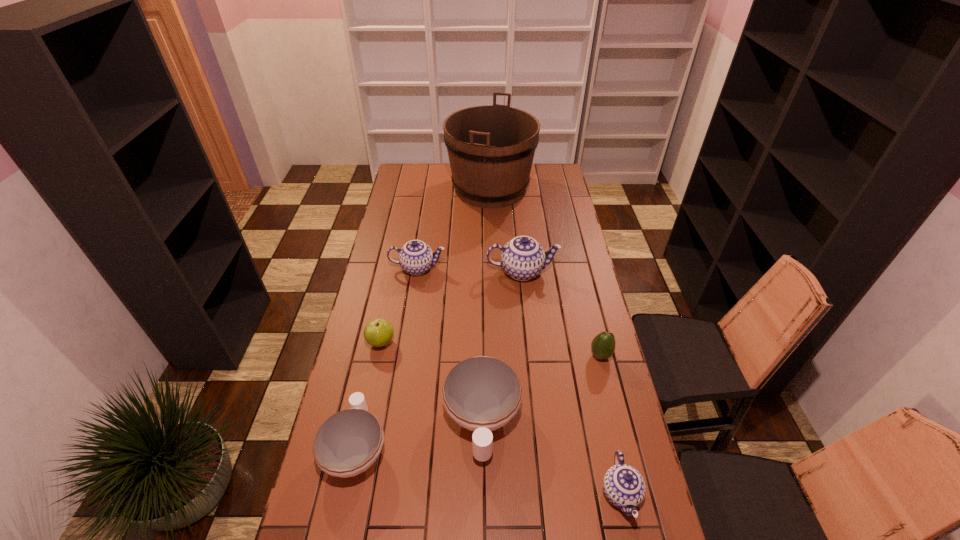
This screenshot has height=540, width=960. I want to click on object at the far edge, so (x=491, y=148).

At what (x,y) coordinates should I click in order to perform the action: click on apple at the left edge. Please return your answer as a coordinate pair (x, y). The width and height of the screenshot is (960, 540). Looking at the image, I should click on (379, 332).

At what (x,y) coordinates should I click in order to perform the action: click on avocado that is positioned at the right edge. Please return your answer as a coordinate pair (x, y). Looking at the image, I should click on (603, 345).

At what (x,y) coordinates should I click in order to perform the action: click on vacant space at the far edge of the desktop. Please return your answer as a coordinate pair (x, y). The height and width of the screenshot is (540, 960). Looking at the image, I should click on (433, 172).

This screenshot has width=960, height=540. Identify the location of vacant space at the left edge of the desktop. (413, 228).

At what (x,y) coordinates should I click in order to perform the action: click on blank space at the right edge of the desktop. Please return your answer as a coordinate pair (x, y). The height and width of the screenshot is (540, 960). Looking at the image, I should click on (560, 228).

What are the coordinates of `vacant space that is in between the second blue chinaware from right to left and the green avocado` in the screenshot? It's located at (562, 313).

The width and height of the screenshot is (960, 540). In order to click on empty space that is in between the right white chinaware and the tallest chinaware in this screenshot , I will do `click(502, 346)`.

Identify the location of vacant area that lies between the second blue chinaware from right to left and the left white chinaware. This screenshot has height=540, width=960. (439, 360).

Image resolution: width=960 pixels, height=540 pixels. In order to click on vacant area that lies between the right white chinaware and the farthest object in this screenshot , I will do `click(486, 304)`.